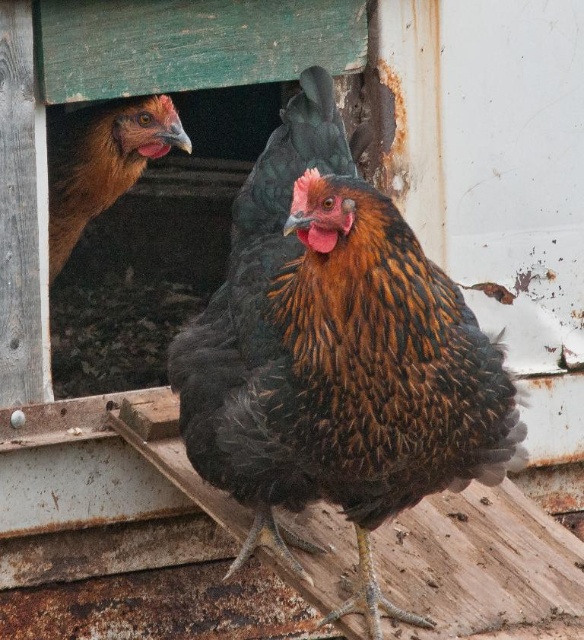
Between brown speckled feathered chicken at center and brown feathered chicken at upper left, which one is positioned lower?

brown speckled feathered chicken at center is below.

Does point (326, 323) come closer to viewer compared to point (105, 168)?

Yes, it is in front of point (105, 168).

Who is more forward, (x=394, y=300) or (x=98, y=205)?

Positioned in front is point (x=394, y=300).

At what (x,y) coordinates should I click in order to perform the action: click on brown speckled feathered chicken at center. Please return your answer as a coordinate pair (x, y). Looking at the image, I should click on (336, 355).